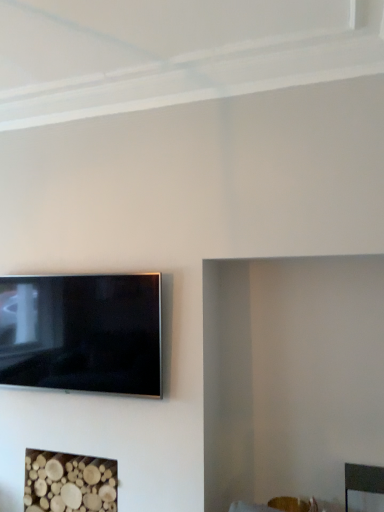
This screenshot has width=384, height=512. Describe the element at coordinates (69, 483) in the screenshot. I see `wooden logs at lower left` at that location.

Where is `wooden logs at lower left`? Image resolution: width=384 pixels, height=512 pixels. wooden logs at lower left is located at coordinates (69, 483).

At what (x,y) coordinates should I click in order to perform the action: click on matte black tv at lower left. Please return your answer as a coordinate pair (x, y). This screenshot has height=512, width=384. Looking at the image, I should click on (82, 333).

Describe the element at coordinates (82, 333) in the screenshot. This screenshot has height=512, width=384. I see `matte black tv at lower left` at that location.

Where is `wooden logs at lower left`? Image resolution: width=384 pixels, height=512 pixels. wooden logs at lower left is located at coordinates (69, 483).

Between matte black tv at lower left and wooden logs at lower left, which one appears on the right side from the viewer's perspective?

From the viewer's perspective, wooden logs at lower left appears more on the right side.

Is the depth of matte black tv at lower left greater than that of wooden logs at lower left?

No, the depth of matte black tv at lower left is less than that of wooden logs at lower left.

Does point (127, 373) lie behind point (71, 500)?

No, (127, 373) is closer to viewer.

From the image's perspective, which one is positioned lower, matte black tv at lower left or wooden logs at lower left?

wooden logs at lower left appears lower in the image.

From a real-world perspective, is matte black tv at lower left physically located above or below wooden logs at lower left?

From a real-world perspective, matte black tv at lower left is physically above wooden logs at lower left.

Considering the sizes of matte black tv at lower left and wooden logs at lower left in the image, is matte black tv at lower left wider or thinner than wooden logs at lower left?

Considering their sizes, matte black tv at lower left looks slimmer than wooden logs at lower left.

Between matte black tv at lower left and wooden logs at lower left, which one has less height?

wooden logs at lower left is shorter.

Considering the sizes of objects matte black tv at lower left and wooden logs at lower left in the image provided, who is smaller, matte black tv at lower left or wooden logs at lower left?

matte black tv at lower left is smaller.

Is matte black tv at lower left spatially inside wooden logs at lower left, or outside of it?

matte black tv at lower left is outside wooden logs at lower left.

Are matte black tv at lower left and wooden logs at lower left located far from each other?

No, matte black tv at lower left is not far from wooden logs at lower left.

Is matte black tv at lower left facing away from wooden logs at lower left?

No, matte black tv at lower left's orientation is not away from wooden logs at lower left.

What's the angular difference between matte black tv at lower left and wooden logs at lower left's facing directions?

The facing directions of matte black tv at lower left and wooden logs at lower left are 0.345 degrees apart.

This screenshot has height=512, width=384. Identify the location of television lying on the left of wooden logs at lower left. (82, 333).

Considering the relative positions of wooden logs at lower left and matte black tv at lower left in the image provided, is wooden logs at lower left to the left of matte black tv at lower left from the viewer's perspective?

Incorrect, wooden logs at lower left is not on the left side of matte black tv at lower left.

Does wooden logs at lower left come behind matte black tv at lower left?

Yes, wooden logs at lower left is further from the camera.

Is point (51, 495) more distant than point (54, 380)?

No, it is not.

From the image's perspective, is wooden logs at lower left below matte black tv at lower left?

Yes, from the image's perspective, wooden logs at lower left is below matte black tv at lower left.

From a real-world perspective, is wooden logs at lower left over matte black tv at lower left?

No, from a real-world perspective, wooden logs at lower left is not on top of matte black tv at lower left.

Looking at their sizes, would you say wooden logs at lower left is wider or thinner than matte black tv at lower left?

wooden logs at lower left is wider than matte black tv at lower left.

Consider the image. Who is taller, wooden logs at lower left or matte black tv at lower left?

With more height is matte black tv at lower left.

Consider the image. Considering the relative sizes of wooden logs at lower left and matte black tv at lower left in the image provided, is wooden logs at lower left smaller than matte black tv at lower left?

No, wooden logs at lower left is not smaller than matte black tv at lower left.

Is matte black tv at lower left inside wooden logs at lower left?

No, matte black tv at lower left is located outside of wooden logs at lower left.

Would you consider wooden logs at lower left to be distant from matte black tv at lower left?

No, wooden logs at lower left is not far away from matte black tv at lower left.

Is wooden logs at lower left aimed at matte black tv at lower left?

No, wooden logs at lower left does not turn towards matte black tv at lower left.

Locate an element on the screen. This screenshot has width=384, height=512. fireplace below the matte black tv at lower left (from a real-world perspective) is located at coordinates (69, 483).

At what (x,y) coordinates should I click in order to perform the action: click on television in front of the wooden logs at lower left. Please return your answer as a coordinate pair (x, y). This screenshot has height=512, width=384. Looking at the image, I should click on (82, 333).

This screenshot has width=384, height=512. Find the location of `television on the left of wooden logs at lower left`. television on the left of wooden logs at lower left is located at coordinates (82, 333).